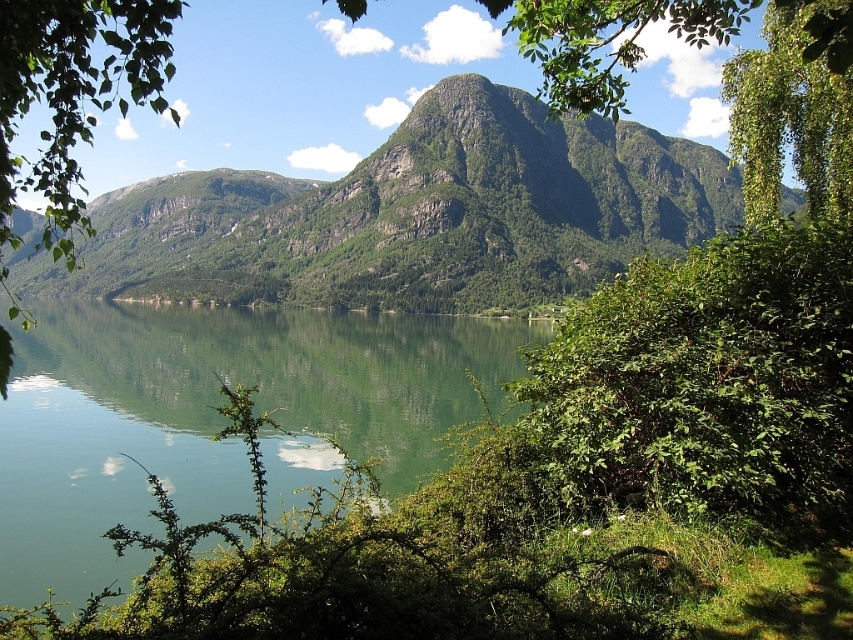
Based on the photo, you are an artist sketching this scene. You want to draw the green leafy branch at left and the green reflective water at center. Which object should you sketch first if you follow the rule of drawing from the top to the bottom of the page?

You should sketch the green leafy branch at left first because it is positioned above the green reflective water at center, so it should be drawn before the water to maintain proper layering.

You are an artist sketching the landscape. You want to focus on the green reflective water at center and the green leafy branch at left. Which object should you draw first if you follow the rule of starting with the larger elements?

The green leafy branch at left should be drawn first because it occupies more space than the green reflective water at center according to the description.